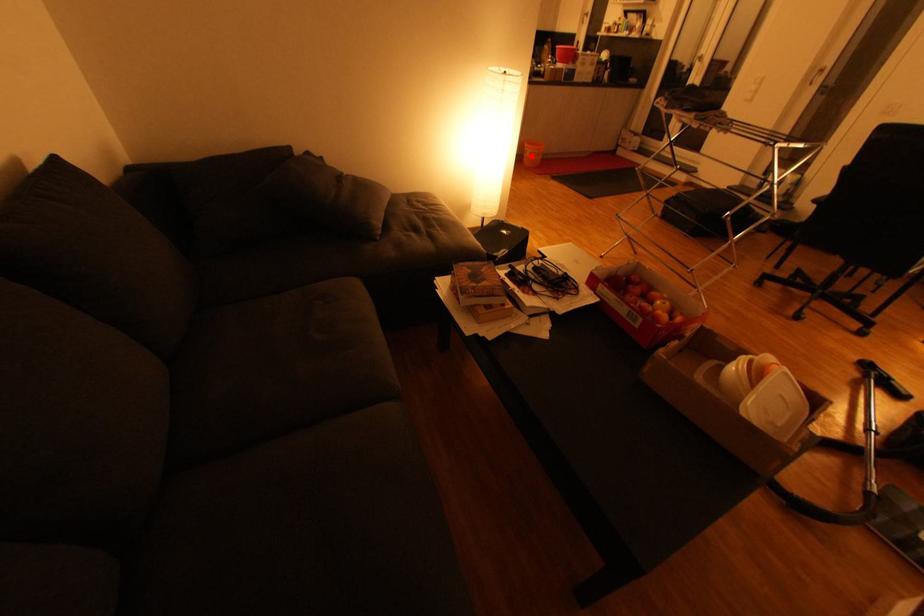
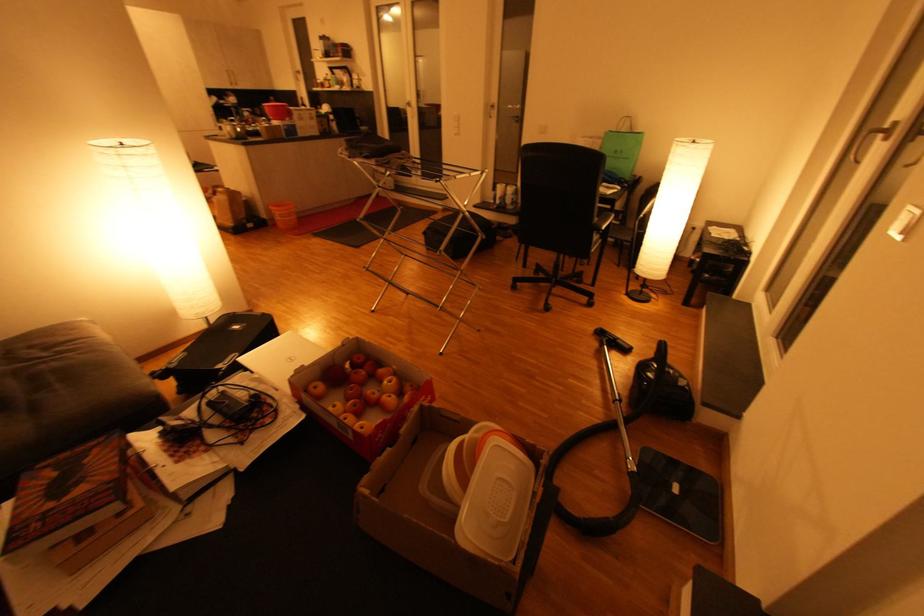
Where in the second image is the point corresponding to the highlighted location from the first image?

(282, 219)